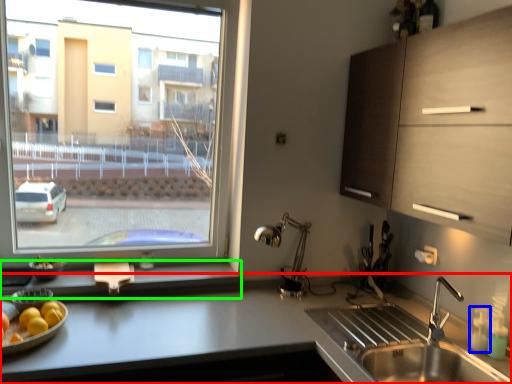
Question: Considering the real-world distances, which object is farthest from countertop (highlighted by a red box)? bottle (highlighted by a blue box) or window sill (highlighted by a green box)?

Choices:
 (A) bottle
 (B) window sill

Answer: (A)